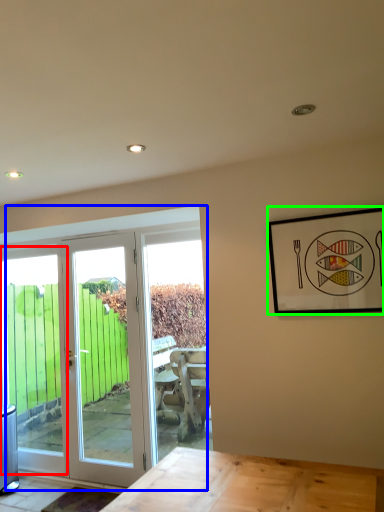
Question: Considering the real-world distances, which object is closest to window (highlighted by a red box)? door (highlighted by a blue box) or picture frame (highlighted by a green box).

Choices:
 (A) door
 (B) picture frame

Answer: (A)